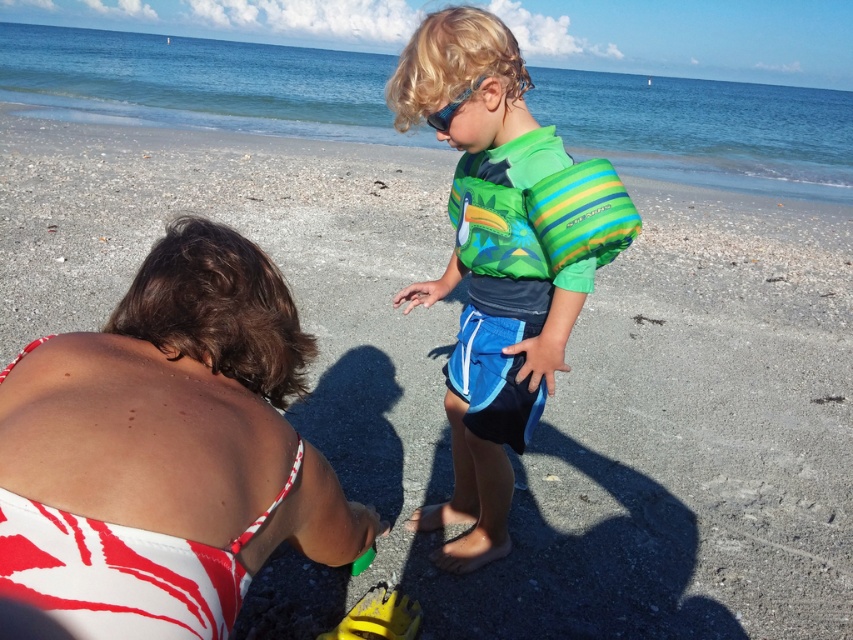
Question: Can you confirm if white printed swimsuit at lower left is positioned to the left of green striped life jacket at center?

Choices:
 (A) yes
 (B) no

Answer: (A)

Question: Which point is closer to the camera taking this photo?

Choices:
 (A) (469, 401)
 (B) (448, 125)

Answer: (B)

Question: Estimate the real-world distances between objects in this image. Which object is farther from the green striped life jacket at center?

Choices:
 (A) transparent plastic goggles at upper center
 (B) green matte swimsuit at center

Answer: (A)

Question: Can you confirm if green matte swimsuit at center is positioned below green striped life jacket at center?

Choices:
 (A) yes
 (B) no

Answer: (A)

Question: Does green matte swimsuit at center appear on the left side of transparent plastic goggles at upper center?

Choices:
 (A) yes
 (B) no

Answer: (B)

Question: Which of the following is the closest to the observer?

Choices:
 (A) (492, 292)
 (B) (599, 168)
 (C) (438, 116)
 (D) (219, 419)

Answer: (D)